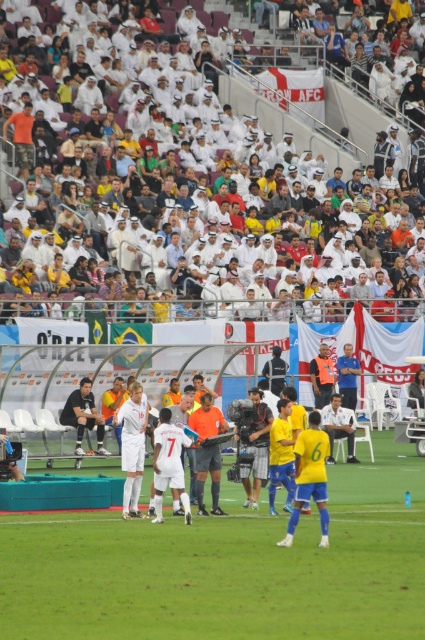
Question: Which object is farther from the camera taking this photo?

Choices:
 (A) orange fabric camera at center
 (B) white fabric shirt at center
 (C) dark gray jersey at center
 (D) white fabric crowd at upper center

Answer: (D)

Question: Which object is the farthest from the orange reflective vest at center?

Choices:
 (A) white matte jersey at center
 (B) dark gray jersey at center
 (C) green grass field at center

Answer: (C)

Question: Does white matte jersey at center lie in front of orange fabric camera at center?

Choices:
 (A) no
 (B) yes

Answer: (B)

Question: Can you confirm if green grass field at center is positioned to the right of orange reflective vest at center?

Choices:
 (A) yes
 (B) no

Answer: (B)

Question: Does dark gray jersey at center appear under orange reflective vest at center?

Choices:
 (A) yes
 (B) no

Answer: (A)

Question: Which object is the closest to the white matte jersey at center?

Choices:
 (A) white fabric crowd at upper center
 (B) orange fabric camera at center
 (C) white fabric shirt at center

Answer: (B)